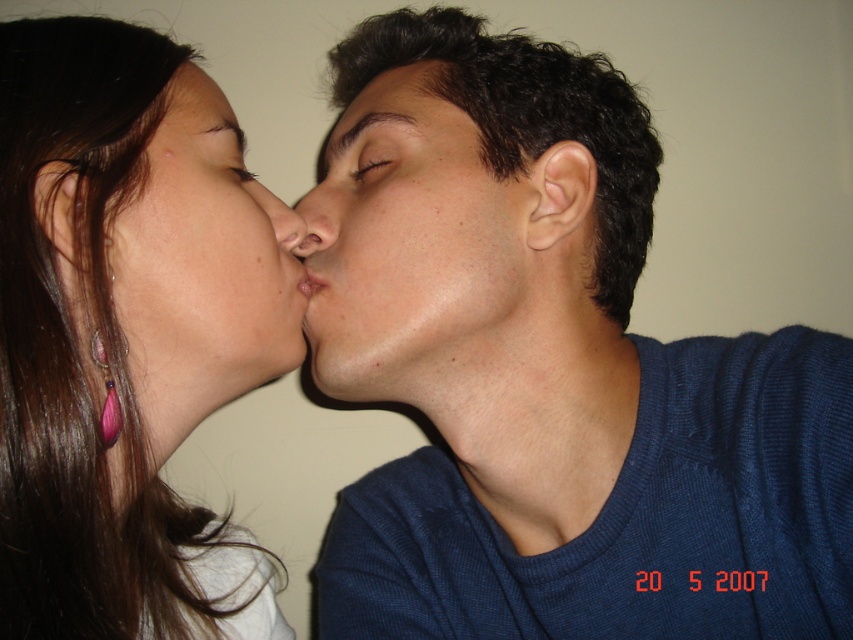
You are an artist sketching the scene and want to ensure accurate proportions. Which nose, the smooth skin nose at center or the matte skin nose at center, should you draw first if you want to follow the order of tallest to shortest?

The smooth skin nose at center is taller than the matte skin nose at center, so you should draw the smooth skin nose at center first.

You are an AI analyzing facial positions in photos. In the image, there is a smooth skin face at upper left. What are its coordinates?

The smooth skin face at upper left is located at coordinates point [125,333].